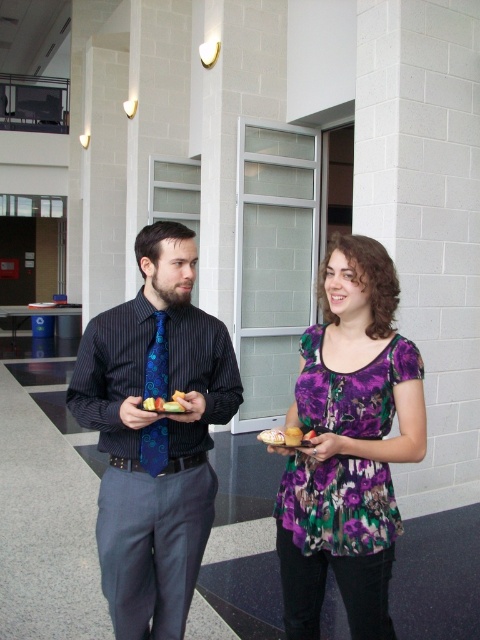
You are a photographer positioned in the hallway and want to take a photo that includes both the blue patterned tie at center and the golden bread at center. Based on their positions, which object should you adjust your focus to capture first to ensure both are in frame?

The blue patterned tie at center is located below the golden bread at center. To capture both in frame, focus on the golden bread at center first as it is higher up, then adjust downwards to include the blue patterned tie at center.